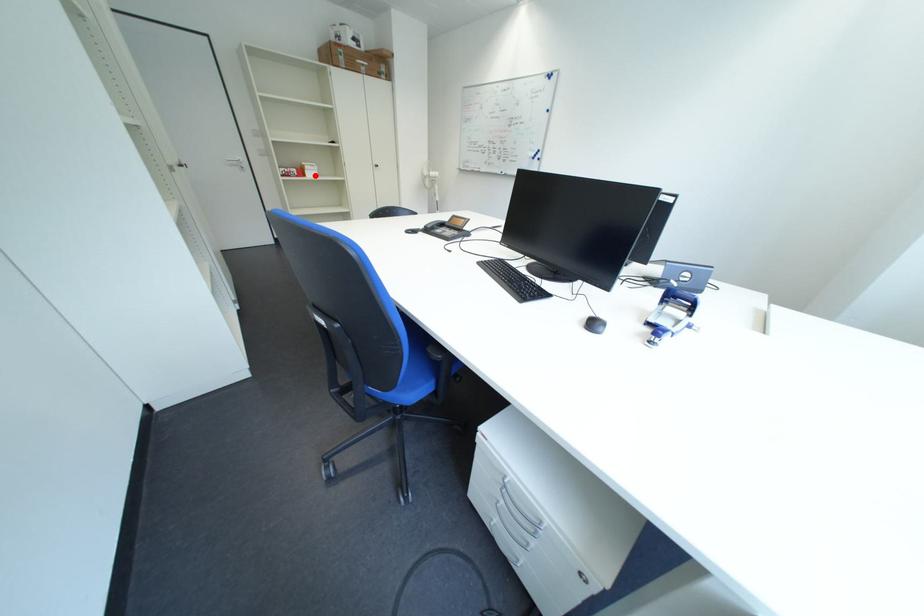
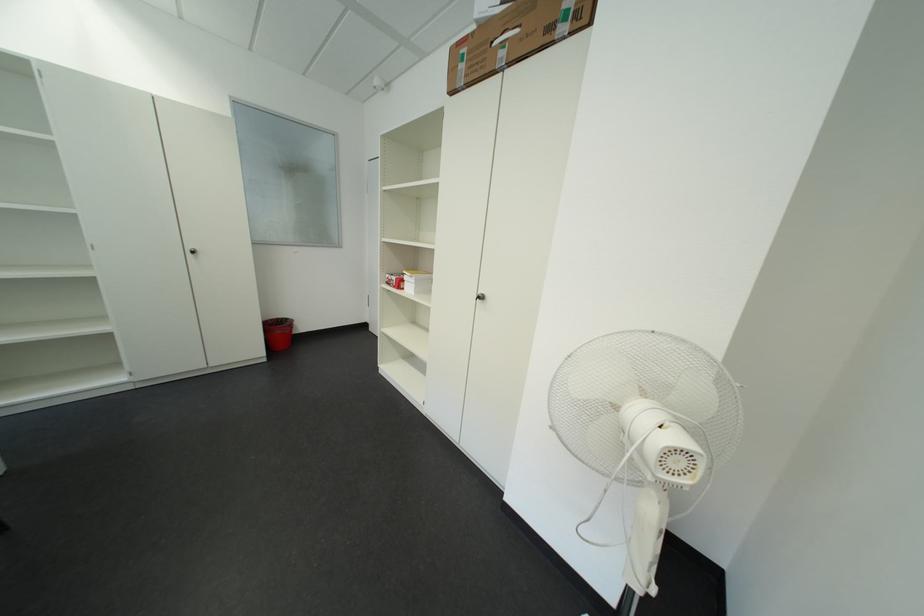
In the second image, find the point that corresponds to the highlighted location in the first image.

(411, 286)